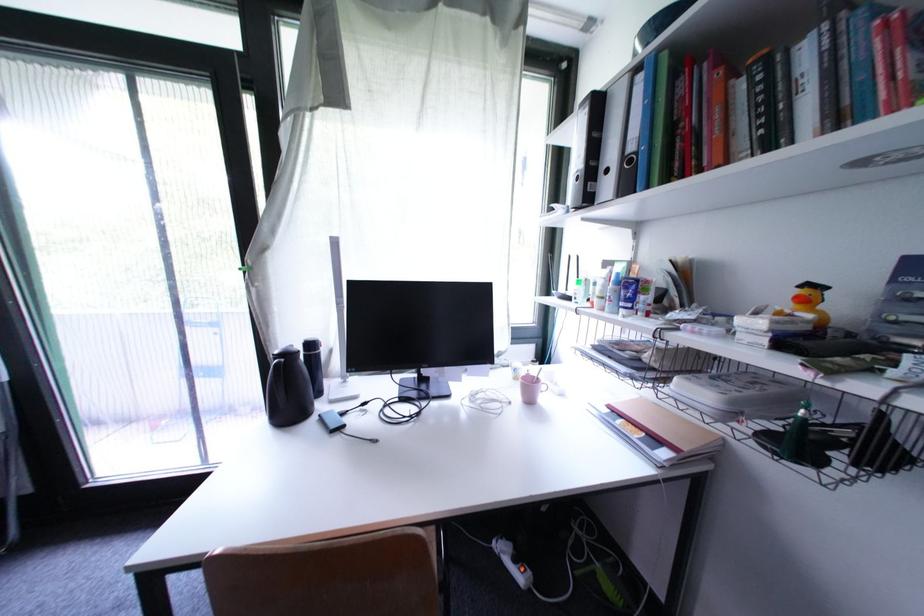
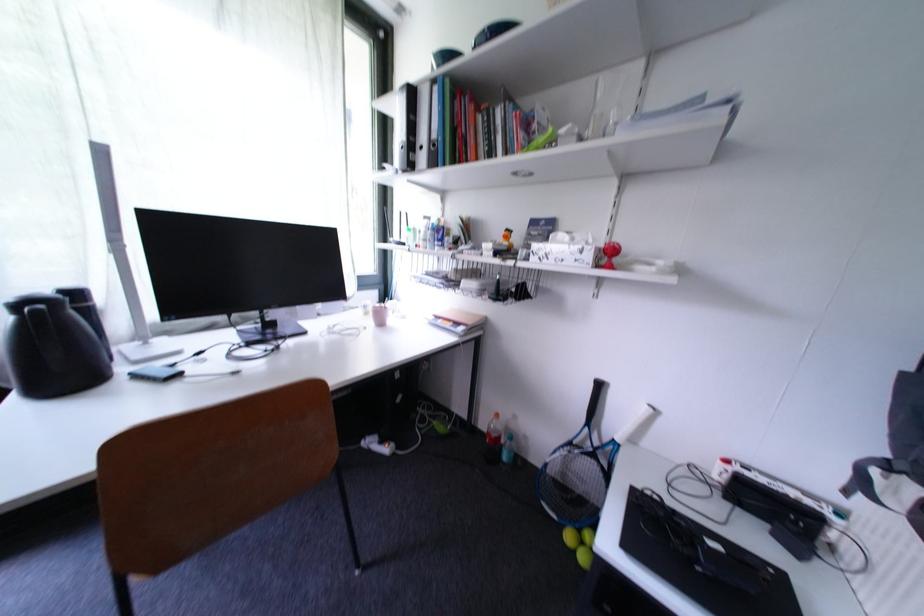
Where in the second image is the point corresponding to (x=581, y=135) from the first image?

(405, 110)